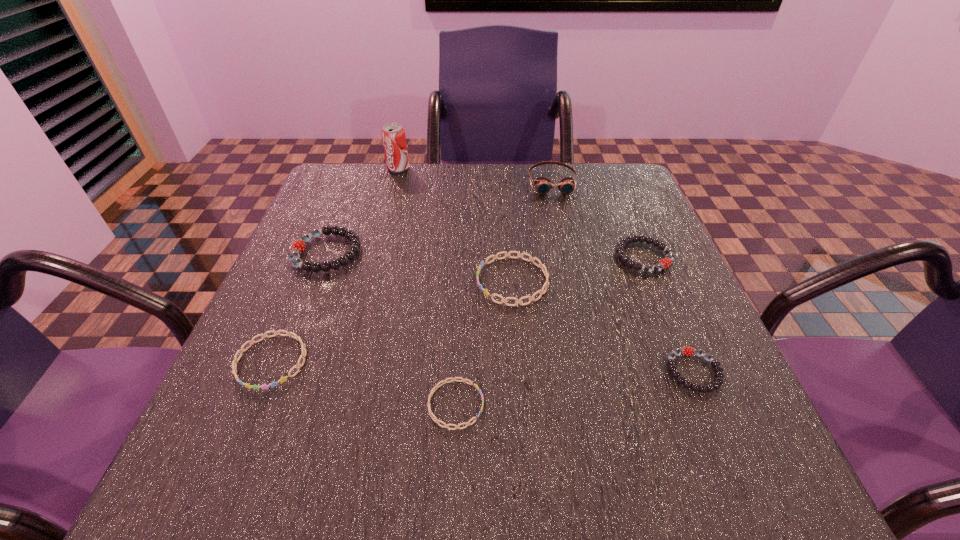
You are a GUI agent. You are given a task and a screenshot of the screen. Output one action in this format:
    pyautogui.click(x=<x>, y=<y>)
    Task: Click on the smallest blue bracelet
    
    Given the screenshot: What is the action you would take?
    pyautogui.click(x=431, y=414)

You are a GUI agent. You are given a task and a screenshot of the screen. Output one action in this format:
    pyautogui.click(x=<x>, y=<y>)
    Task: Click on the free point located 0.260m on the front of the third object from left to right
    
    Given the screenshot: What is the action you would take?
    pyautogui.click(x=381, y=231)

Image resolution: width=960 pixels, height=540 pixels. I want to click on vacant space located through the lenses of the seventh shortest object, so click(561, 224).

The image size is (960, 540). Find the location of `free region located 0.190m on the front of the biggest black bracelet`. free region located 0.190m on the front of the biggest black bracelet is located at coordinates (289, 348).

You are a GUI agent. You are given a task and a screenshot of the screen. Output one action in this format:
    pyautogui.click(x=<x>, y=<y>)
    Task: Click on the vacant space situated 0.250m on the surface of the farthest blue bracelet showing star-shaped elements
    The image size is (960, 540).
    Given the screenshot: What is the action you would take?
    pyautogui.click(x=355, y=281)

I want to click on blank space located 0.330m on the surface of the farthest blue bracelet showing star-shaped elements, so click(316, 281).

Where is `free space located 0.220m on the surface of the farthest blue bracelet showing star-shaped elements`? free space located 0.220m on the surface of the farthest blue bracelet showing star-shaped elements is located at coordinates (370, 281).

At what (x,y) coordinates should I click in order to perform the action: click on vacant point located on the back of the second smallest black bracelet. Please return your answer as a coordinate pair (x, y). Looking at the image, I should click on (612, 182).

Where is `vacant region located on the surface of the second smallest blue bracelet showing star-shaped elements`? Image resolution: width=960 pixels, height=540 pixels. vacant region located on the surface of the second smallest blue bracelet showing star-shaped elements is located at coordinates (247, 420).

This screenshot has height=540, width=960. What are the coordinates of `free spot located on the left of the nearest black bracelet` in the screenshot? It's located at (626, 372).